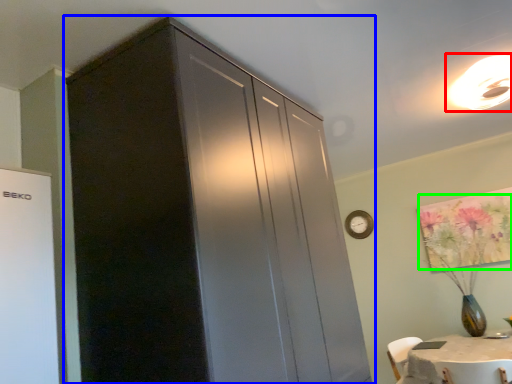
Question: Which is nearer to the light fixture (highlighted by a red box)? cupboard (highlighted by a blue box) or flower (highlighted by a green box).

Choices:
 (A) cupboard
 (B) flower

Answer: (B)